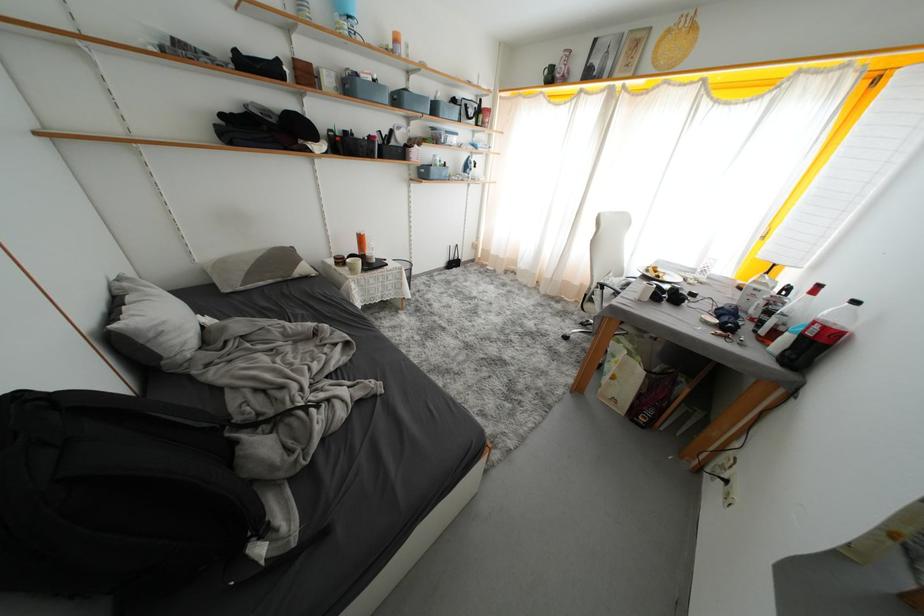
Locate an element on the screen. white pump dispenser is located at coordinates (755, 292).